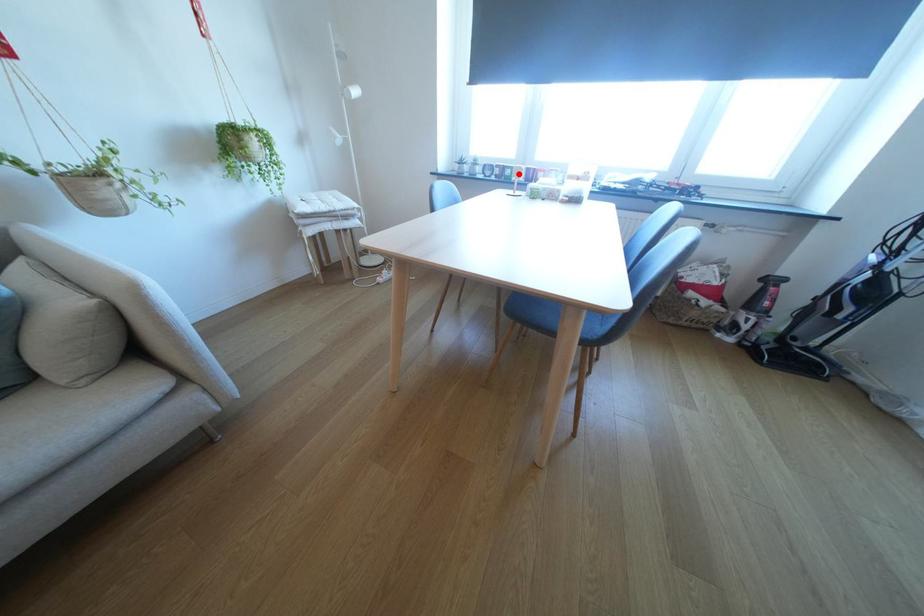
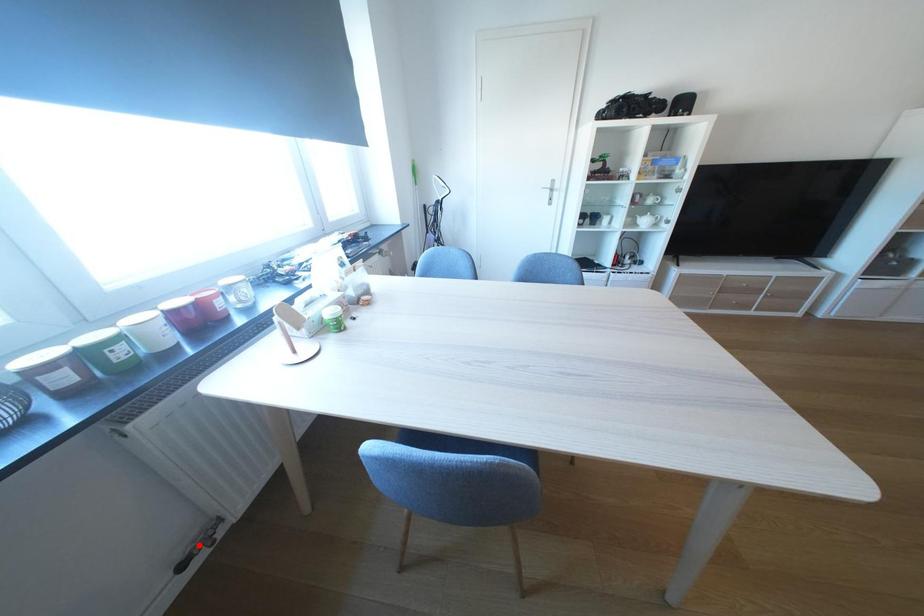
I am providing you with two images of the same scene from different viewpoints. A red point is marked on the first image and another point is marked on the second image. Do the highlighted points in image1 and image2 indicate the same real-world spot?

No